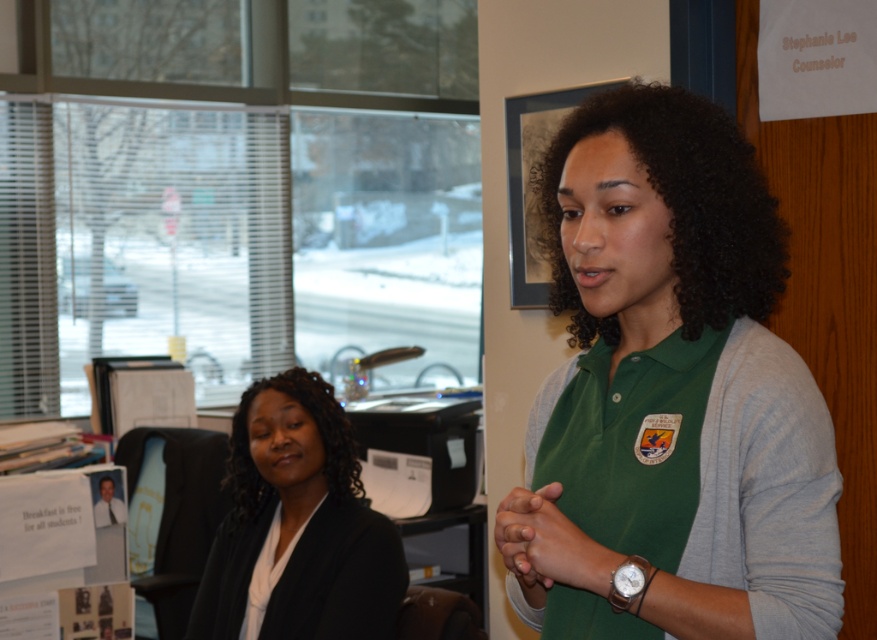
You are a photographer setting up for a portrait session in this office. You want to ensure both the black silky hair at center and the silver metallic watch at lower right are clearly visible in the photo. Which object should you focus on first to ensure depth of field captures both?

The black silky hair at center should be focused on first because it is above the silver metallic watch at lower right, meaning it is closer to the camera. By focusing on the closer object, the depth of field will naturally extend to include the farther object.

You are an interior designer assessing the layout of this office. You need to place a small plant exactly at point (x=297, y=525). What object will the plant be placed near?

The plant will be placed near the black matte blazer at left, as that is the object located at point (x=297, y=525).

You are an interior designer assessing the placement of items in this office scene. The black matte blazer at left and silver metallic watch at lower right are both visible in the image. Which object occupies more vertical space in the scene?

The black matte blazer at left has a greater height compared to the silver metallic watch at lower right, so it occupies more vertical space in the scene.